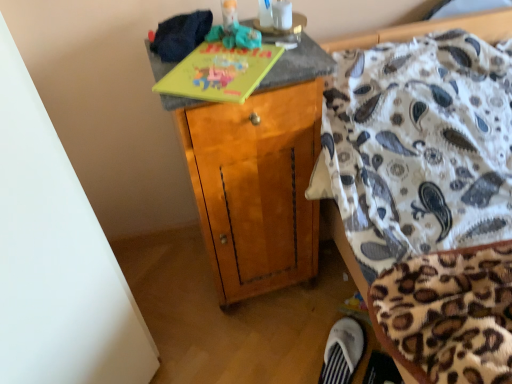
Measure the distance between point [349,378] and camera.

The depth of point [349,378] is 1.26 meters.

What is the approximate height of wooden cabinet at center?

It is 34.70 inches.

This screenshot has height=384, width=512. What are the coordinates of `yellow matte book at upper center` in the screenshot? It's located at (219, 73).

Can you tell me how much white fabric slipper at lower right and rubberized green toy at upper center differ in facing direction?

87.3 degrees.

The image size is (512, 384). I want to click on footwear that is under the rubberized green toy at upper center (from a real-world perspective), so click(343, 351).

Is white fabric slipper at lower right wider than rubberized green toy at upper center?

Yes.

From the image's perspective, is rubberized green toy at upper center above or below white fabric slipper at lower right?

From the image's perspective, rubberized green toy at upper center appears above white fabric slipper at lower right.

Which object is closer to the camera, rubberized green toy at upper center or white fabric slipper at lower right?

rubberized green toy at upper center is in front.

Is white fabric slipper at lower right a part of rubberized green toy at upper center?

Definitely not — white fabric slipper at lower right is not inside rubberized green toy at upper center.

Which is more to the left, white fabric slipper at lower right or yellow matte book at upper center?

yellow matte book at upper center is more to the left.

From a real-world perspective, does white fabric slipper at lower right sit lower than yellow matte book at upper center?

Yes.

In the scene shown: Is white fabric slipper at lower right facing towards yellow matte book at upper center?

No, white fabric slipper at lower right is not turned towards yellow matte book at upper center.

Where is `book above the white fabric slipper at lower right (from the image's perspective)`? This screenshot has width=512, height=384. book above the white fabric slipper at lower right (from the image's perspective) is located at coordinates (219, 73).

Measure the distance between yellow matte book at upper center and white fabric slipper at lower right.

yellow matte book at upper center and white fabric slipper at lower right are 34.21 inches apart from each other.

Which of these two, yellow matte book at upper center or white fabric slipper at lower right, is thinner?

white fabric slipper at lower right is thinner.

You are a GUI agent. You are given a task and a screenshot of the screen. Output one action in this format:
    pyautogui.click(x=<x>, y=<y>)
    Task: Click on the book on the left of white fabric slipper at lower right
    
    Given the screenshot: What is the action you would take?
    pyautogui.click(x=219, y=73)

What's the angular difference between yellow matte book at upper center and white fabric slipper at lower right's facing directions?

There is a 175-degree angle between the facing directions of yellow matte book at upper center and white fabric slipper at lower right.

Locate an element on the screen. Image resolution: width=512 pixels, height=384 pixels. toy that appears above the wooden cabinet at center (from a real-world perspective) is located at coordinates (234, 36).

Is wooden cabinet at center oriented away from rubberized green toy at upper center?

wooden cabinet at center is not turned away from rubberized green toy at upper center.

Considering the relative positions of wooden cabinet at center and rubberized green toy at upper center in the image provided, is wooden cabinet at center to the left of rubberized green toy at upper center from the viewer's perspective?

No.

Considering the sizes of objects wooden cabinet at center and white fabric slipper at lower right in the image provided, who is thinner, wooden cabinet at center or white fabric slipper at lower right?

white fabric slipper at lower right is thinner.

Is the depth of wooden cabinet at center less than that of white fabric slipper at lower right?

Yes, it is.

Is there a large distance between wooden cabinet at center and white fabric slipper at lower right?

Actually, wooden cabinet at center and white fabric slipper at lower right are a little close together.

Could white fabric slipper at lower right be considered to be inside wooden cabinet at center?

Actually, white fabric slipper at lower right is outside wooden cabinet at center.

From the image's perspective, is rubberized green toy at upper center above or below yellow matte book at upper center?

Based on their image positions, rubberized green toy at upper center is located above yellow matte book at upper center.

Does point (237, 30) come closer to viewer compared to point (219, 100)?

No, (237, 30) is behind (219, 100).

Does rubberized green toy at upper center lie in front of yellow matte book at upper center?

No, it is behind yellow matte book at upper center.

Image resolution: width=512 pixels, height=384 pixels. In order to click on toy above the white fabric slipper at lower right (from a real-world perspective) in this screenshot , I will do coord(234,36).

The width and height of the screenshot is (512, 384). Identify the location of footwear behind the rubberized green toy at upper center. (343, 351).

Estimate the real-world distances between objects in this image. Which object is closer to rubberized green toy at upper center, yellow matte book at upper center or wooden cabinet at center?

The object closer to rubberized green toy at upper center is yellow matte book at upper center.

From the image, which object appears to be nearer to rubberized green toy at upper center, wooden cabinet at center or white fabric slipper at lower right?

wooden cabinet at center is positioned closer to the anchor rubberized green toy at upper center.

When comparing their distances from rubberized green toy at upper center, does white fabric slipper at lower right or wooden cabinet at center seem closer?

Among the two, wooden cabinet at center is located nearer to rubberized green toy at upper center.

Considering their positions, is rubberized green toy at upper center positioned closer to white fabric slipper at lower right than wooden cabinet at center?

Based on the image, wooden cabinet at center appears to be nearer to white fabric slipper at lower right.

Based on their spatial positions, is yellow matte book at upper center or wooden cabinet at center further from white fabric slipper at lower right?

yellow matte book at upper center is further to white fabric slipper at lower right.

When comparing their distances from yellow matte book at upper center, does white fabric slipper at lower right or wooden cabinet at center seem closer?

wooden cabinet at center lies closer to yellow matte book at upper center than the other object.

From the image, which object appears to be farther from rubberized green toy at upper center, white fabric slipper at lower right or yellow matte book at upper center?

The object further to rubberized green toy at upper center is white fabric slipper at lower right.

Estimate the real-world distances between objects in this image. Which object is further from yellow matte book at upper center, wooden cabinet at center or rubberized green toy at upper center?

Based on the image, wooden cabinet at center appears to be further to yellow matte book at upper center.

The width and height of the screenshot is (512, 384). I want to click on book between rubberized green toy at upper center and white fabric slipper at lower right in the up-down direction, so click(x=219, y=73).

Find the location of a particular element. The image size is (512, 384). cabinetry between rubberized green toy at upper center and white fabric slipper at lower right in the up-down direction is located at coordinates (256, 187).

Image resolution: width=512 pixels, height=384 pixels. I want to click on cabinetry between yellow matte book at upper center and white fabric slipper at lower right in the vertical direction, so click(256, 187).

Where is `book that lies between rubberized green toy at upper center and wooden cabinet at center from top to bottom`? The width and height of the screenshot is (512, 384). book that lies between rubberized green toy at upper center and wooden cabinet at center from top to bottom is located at coordinates (219, 73).